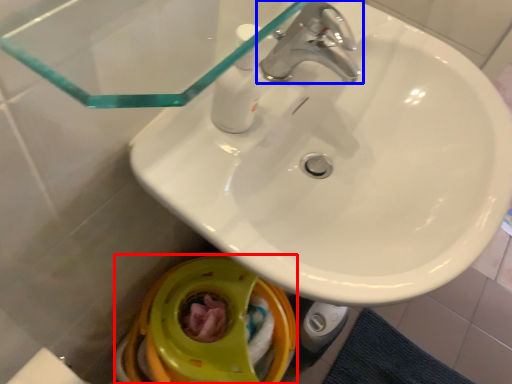
Question: Which point is further to the camera, toilet bowl (highlighted by a red box) or tap (highlighted by a blue box)?

Choices:
 (A) toilet bowl
 (B) tap

Answer: (A)